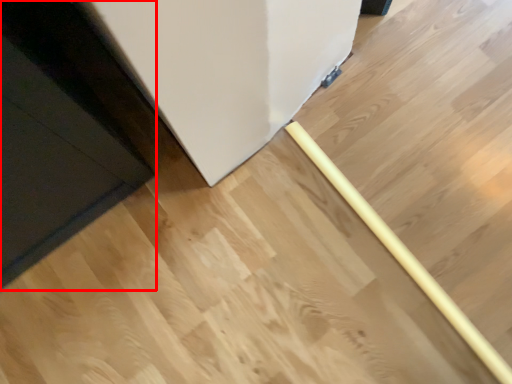
Question: Considering the relative positions of door (annotated by the red box) and rolling pin in the image provided, where is door (annotated by the red box) located with respect to the staircase?

Choices:
 (A) right
 (B) left

Answer: (B)